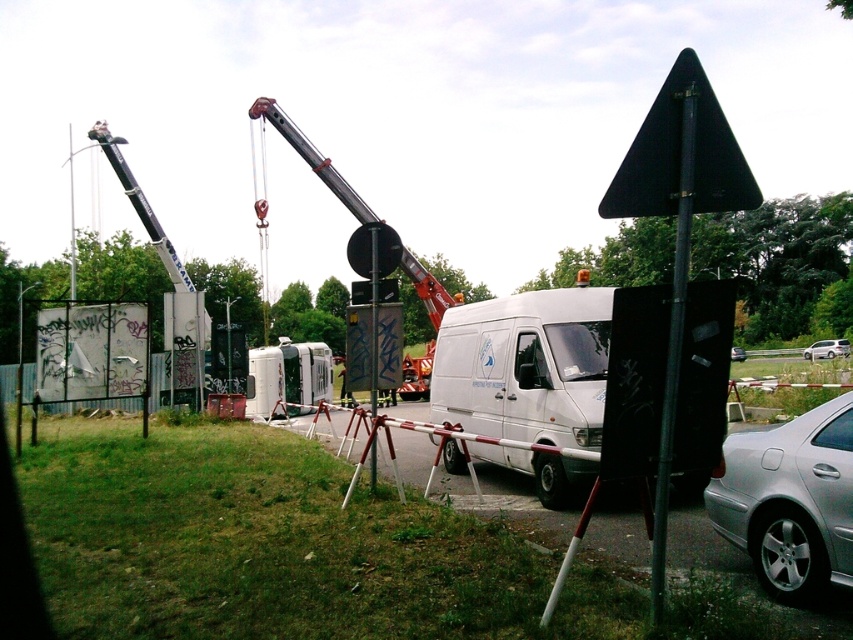
You are a delivery driver who needs to park your truck between the white matte van at center and the silver metallic car at center. Given that your truck is 6 meters long, can you fit it in the space between them?

The white matte van at center is smaller than the silver metallic car at center, but the exact distance between them isn not provided. Without knowing the available space, it is impossible to determine if the truck will fit.

You are a surveyor using a coordinate system where lower numbers mean closer to the camera. You need to determine which of the two points, point (664,188) or point (326,160), is closer to the camera. Which one is closer?

Point (664,188) is closer to the camera than point (326,160) because in the coordinate system, lower numbers indicate proximity to the camera.

You are a delivery driver approaching the construction site. You see a black matte triangle at upper center and a metallic silver crane at center. Which object is closer to the right side of your view?

The black matte triangle at upper center is closer to the right side of your view because it is positioned to the right of the metallic silver crane at center.